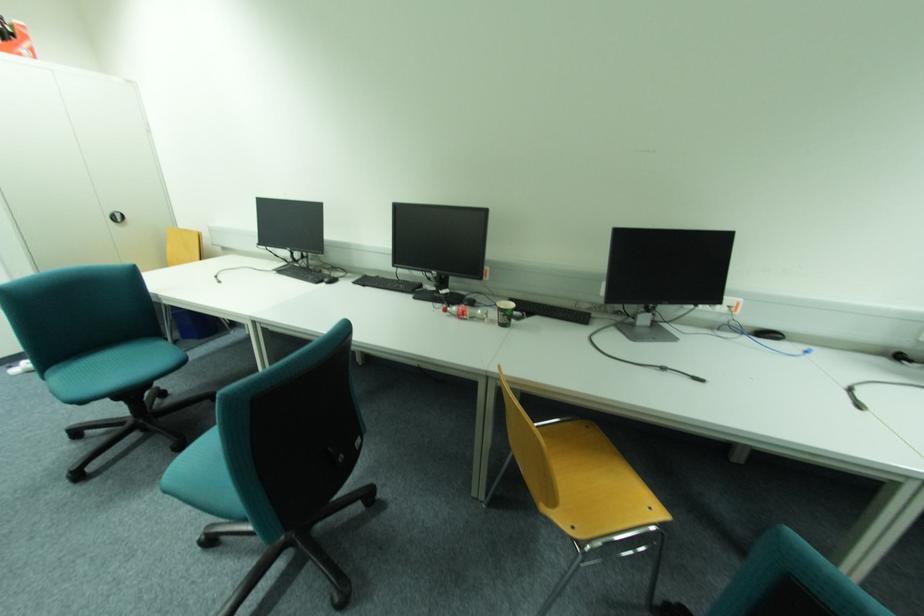
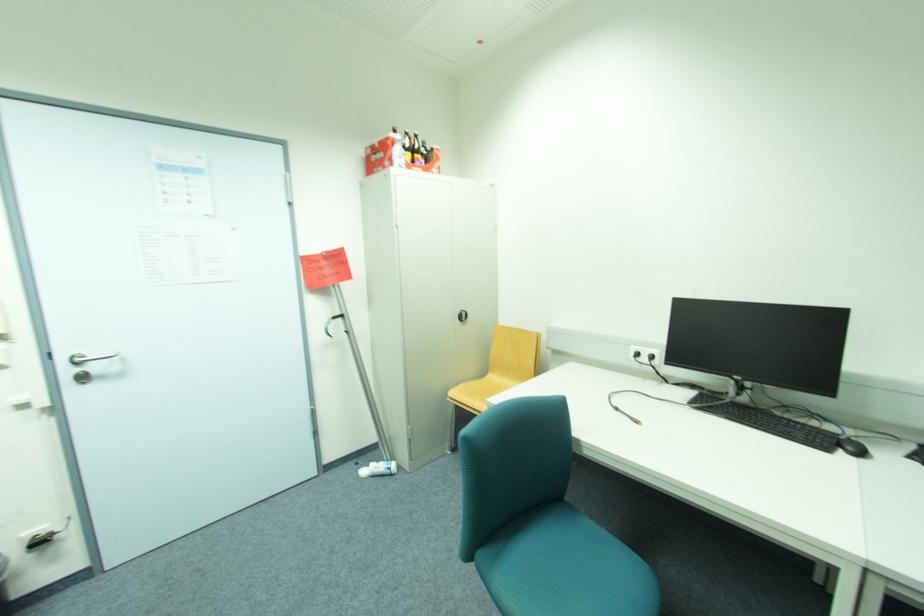
Where in the second image is the point corresponding to the point at 27,365 from the first image?

(373, 468)